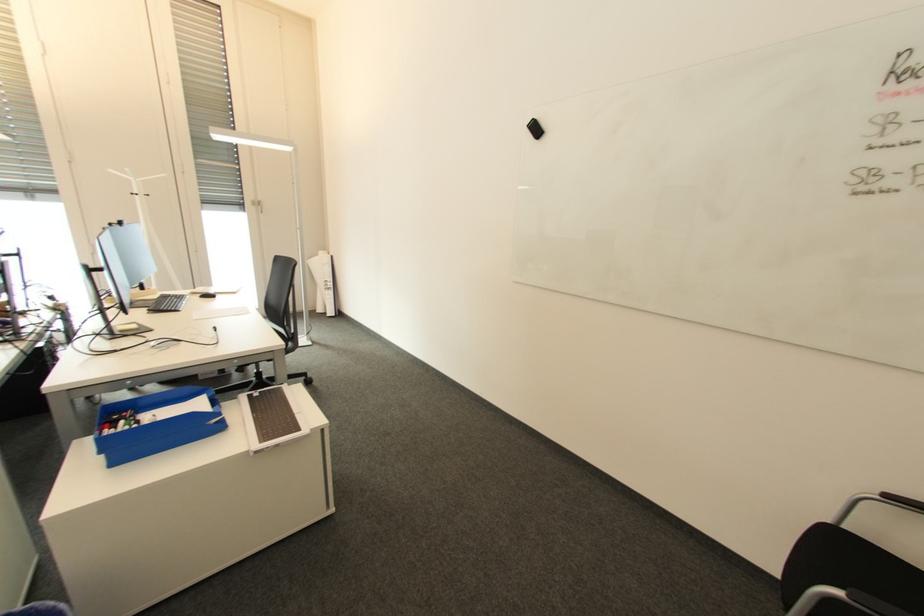
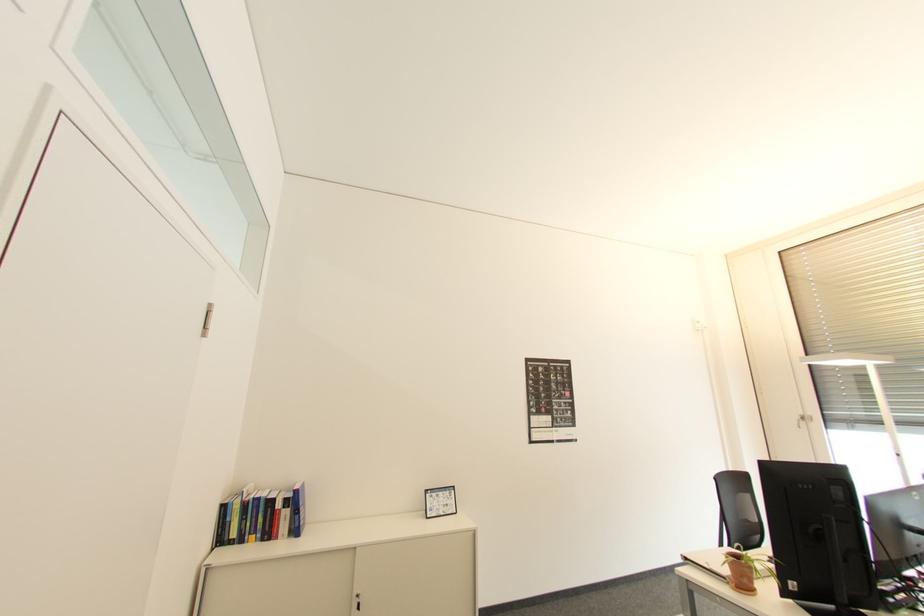
Question: The first image is from the beginning of the video and the second image is from the end. How did the camera likely rotate when shooting the video?

Choices:
 (A) Left
 (B) Right
 (C) Up
 (D) Down

Answer: (A)